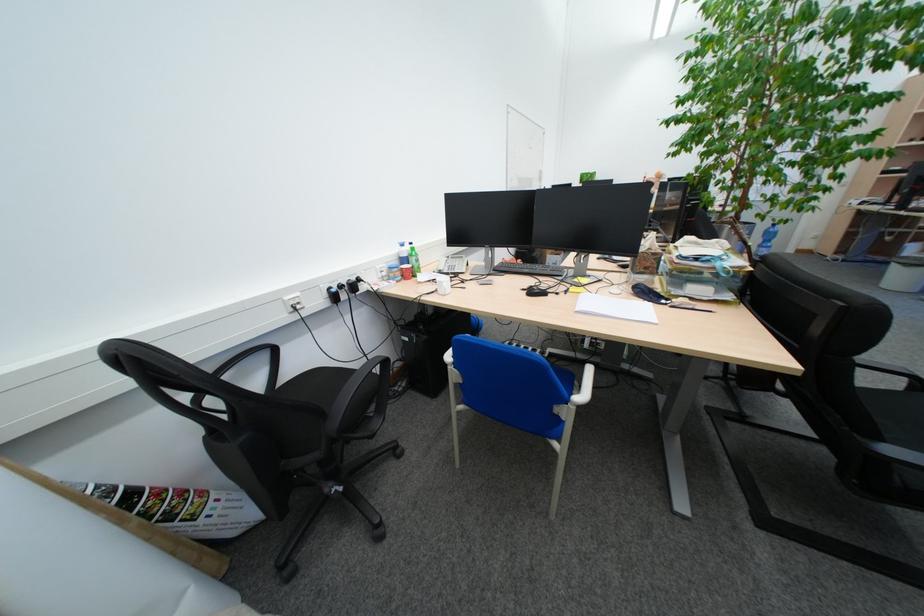
Find where to lift the water bottle. Please return your answer as a coordinate pair (x, y).

(767, 240)